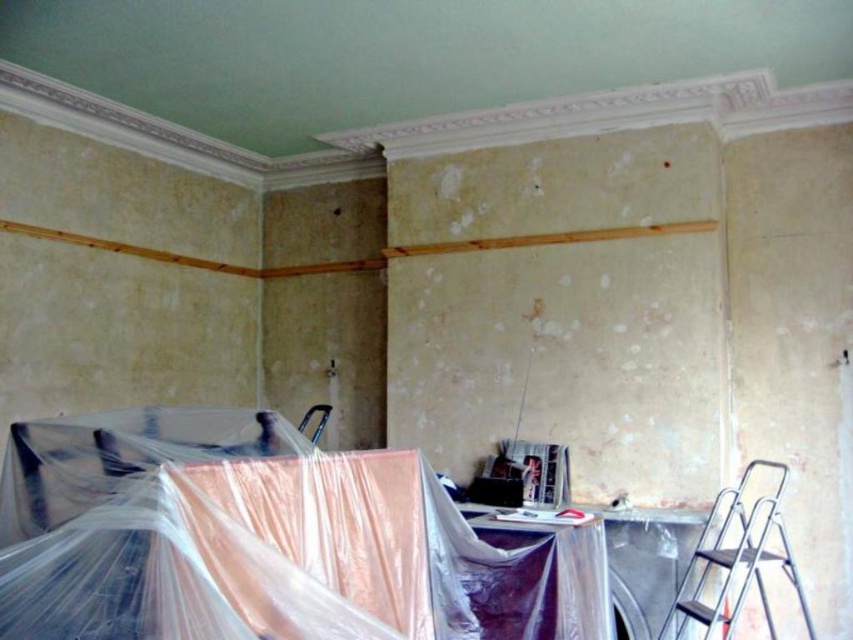
Question: Does clear plastic at lower center have a smaller size compared to silver metallic ladder at lower right?

Choices:
 (A) no
 (B) yes

Answer: (A)

Question: Does clear plastic at lower center come behind silver metallic ladder at lower right?

Choices:
 (A) yes
 (B) no

Answer: (B)

Question: Does clear plastic at lower center have a lesser width compared to silver metallic ladder at lower right?

Choices:
 (A) yes
 (B) no

Answer: (B)